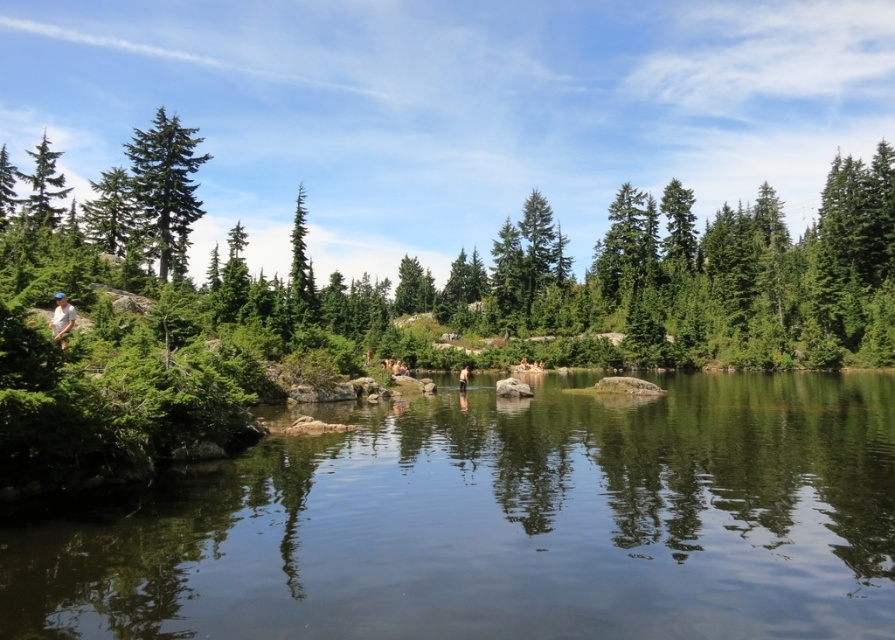
Question: Does clear water at center have a larger size compared to green matte tree at left?

Choices:
 (A) no
 (B) yes

Answer: (A)

Question: Does clear water at center come in front of green matte tree at left?

Choices:
 (A) yes
 (B) no

Answer: (A)

Question: Which of the following is the closest to the observer?

Choices:
 (A) skinny jeans at center
 (B) green matte tree at left

Answer: (A)

Question: Which object is the closest to the green matte tree at upper left?

Choices:
 (A) clear water at center
 (B) skinny jeans at center
 (C) green matte tree at left

Answer: (B)

Question: Which point is closer to the camera?

Choices:
 (A) (73, 323)
 (B) (60, 208)
 (C) (462, 369)
 (D) (179, 259)

Answer: (A)

Question: Does green matte tree at upper left come in front of green matte tree at left?

Choices:
 (A) no
 (B) yes

Answer: (B)